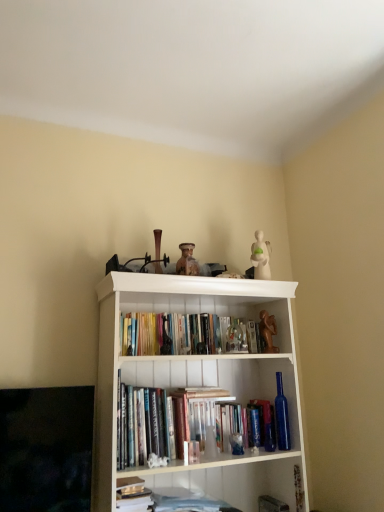
Question: Can you confirm if hardcover book at center is wider than hardcover books at center, which appears as the 3th book when ordered from the bottom?

Choices:
 (A) no
 (B) yes

Answer: (B)

Question: From a real-world perspective, is hardcover book at center on hardcover books at center, which appears as the 3th book when ordered from the bottom?

Choices:
 (A) no
 (B) yes

Answer: (A)

Question: From a real-world perspective, is hardcover book at center physically below hardcover books at center, placed as the 1th book when sorted from top to bottom?

Choices:
 (A) yes
 (B) no

Answer: (A)

Question: Is hardcover book at center not near hardcover books at center, which appears as the 3th book when ordered from the bottom?

Choices:
 (A) yes
 (B) no

Answer: (B)

Question: Would you say hardcover book at center contains hardcover books at center, which appears as the 3th book when ordered from the bottom?

Choices:
 (A) no
 (B) yes

Answer: (A)

Question: From the image's perspective, would you say hardcover book at center is shown under hardcover books at center, placed as the 1th book when sorted from top to bottom?

Choices:
 (A) no
 (B) yes

Answer: (B)

Question: Considering the relative sizes of brown matte statue at upper center and hardcover book at lower center, the second book positioned from the top, in the image provided, is brown matte statue at upper center smaller than hardcover book at lower center, the second book positioned from the top,?

Choices:
 (A) no
 (B) yes

Answer: (B)

Question: Could you tell me if brown matte statue at upper center is facing hardcover book at lower center, the 2th book positioned from the bottom?

Choices:
 (A) no
 (B) yes

Answer: (A)

Question: Does brown matte statue at upper center have a greater height compared to hardcover book at lower center, the second book positioned from the top?

Choices:
 (A) yes
 (B) no

Answer: (A)

Question: Is hardcover book at lower center, the 2th book positioned from the bottom, inside brown matte statue at upper center?

Choices:
 (A) no
 (B) yes

Answer: (A)

Question: Is brown matte statue at upper center bigger than hardcover book at lower center, the second book positioned from the top?

Choices:
 (A) no
 (B) yes

Answer: (A)

Question: Is brown matte statue at upper center positioned with its back to hardcover book at lower center, the second book positioned from the top?

Choices:
 (A) yes
 (B) no

Answer: (B)

Question: From a real-world perspective, is white paper stack at lower center, which is the first book in bottom-to-top order, under brown matte statue at upper center?

Choices:
 (A) yes
 (B) no

Answer: (A)